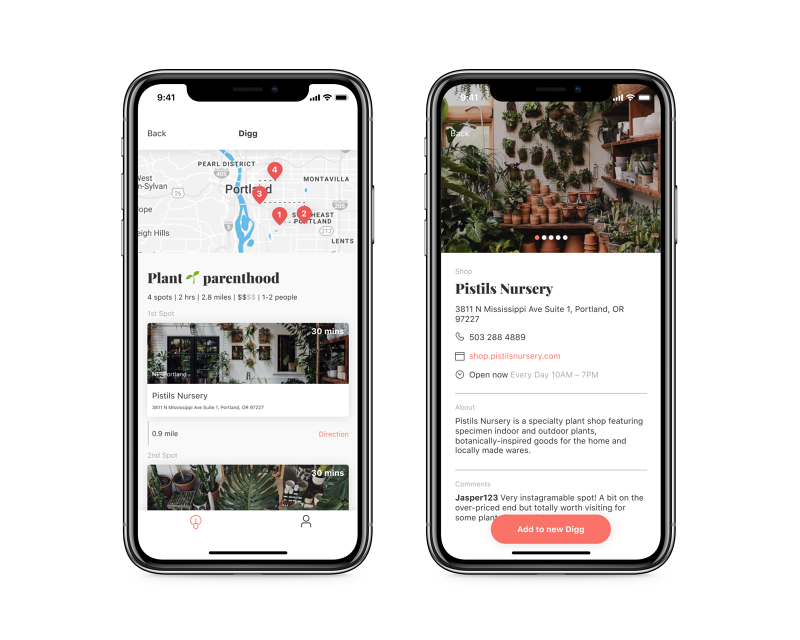
The image size is (800, 640). What are the coordinates of `vases and plants` in the screenshot? It's located at (537, 205).